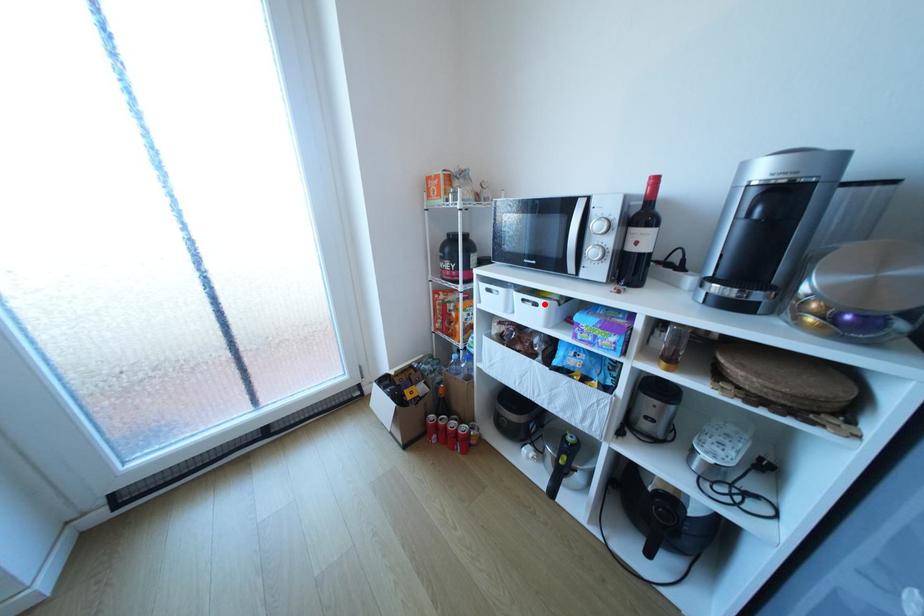
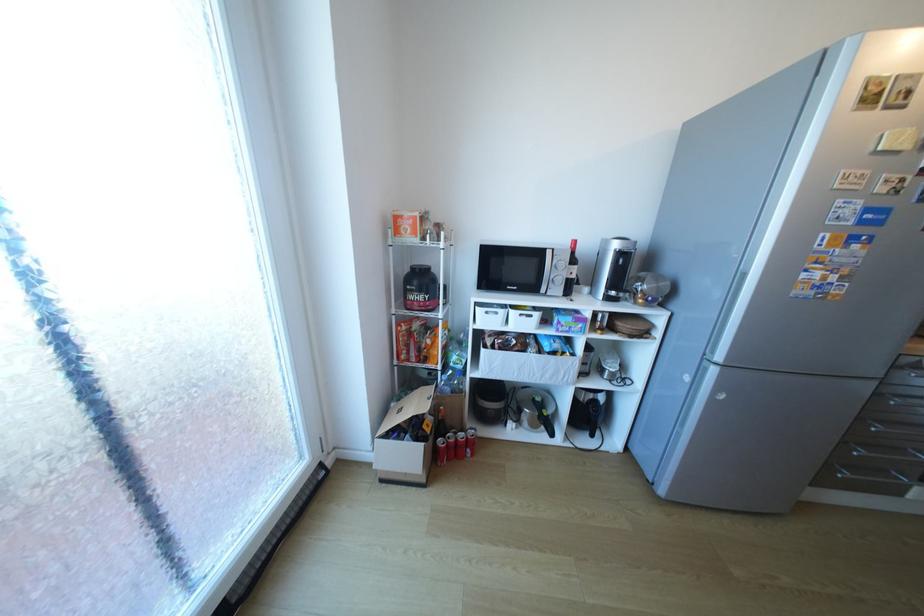
Locate, in the second image, the point that corresponds to the highlighted location in the first image.

(540, 315)